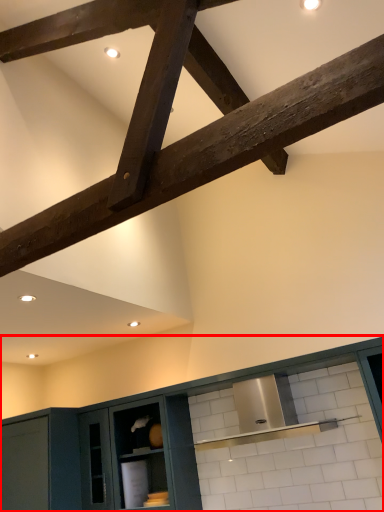
Question: From the image's perspective, considering the relative positions of cabinetry (annotated by the red box) and beam in the image provided, where is cabinetry (annotated by the red box) located with respect to the staircase?

Choices:
 (A) below
 (B) above

Answer: (A)